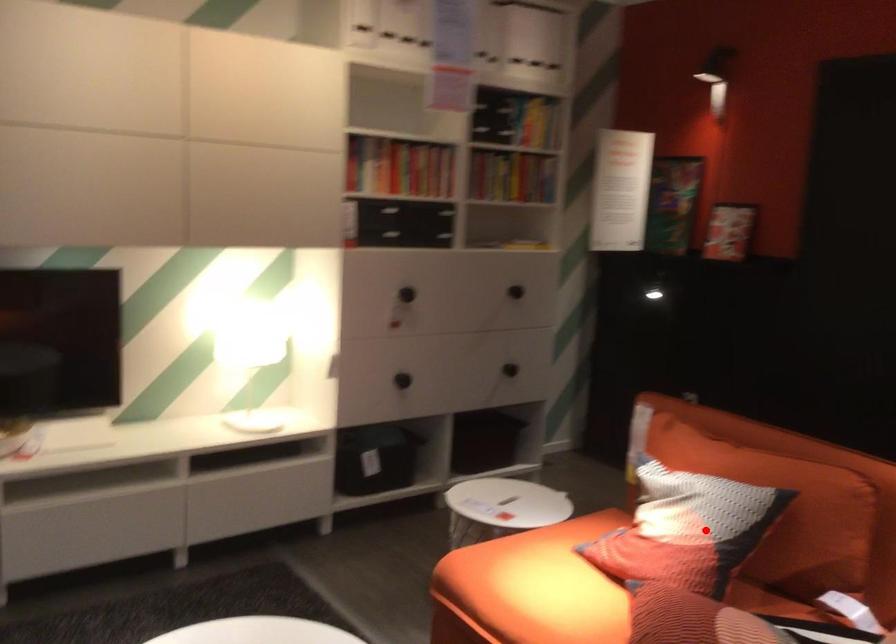
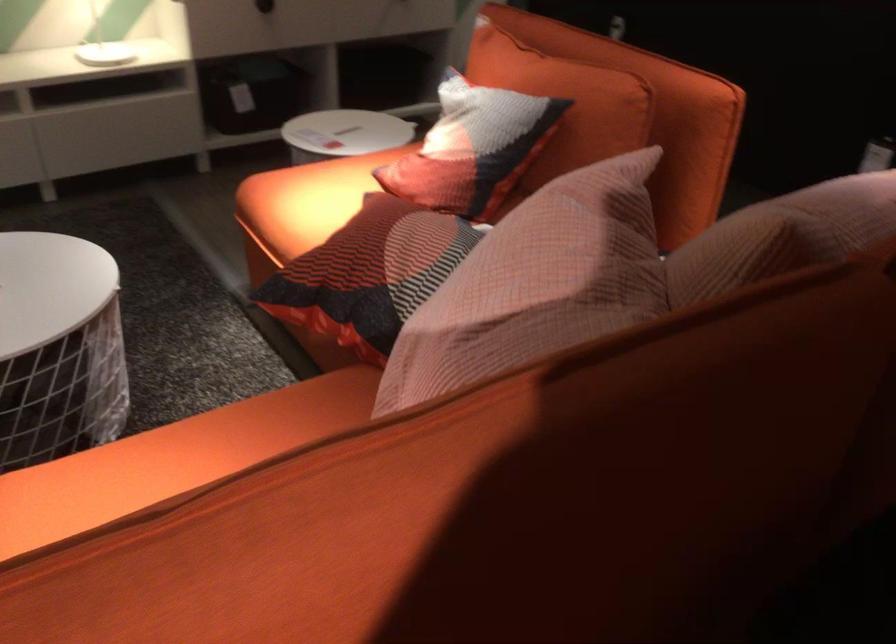
Locate, in the second image, the point that corresponds to the highlighted location in the first image.

(472, 147)